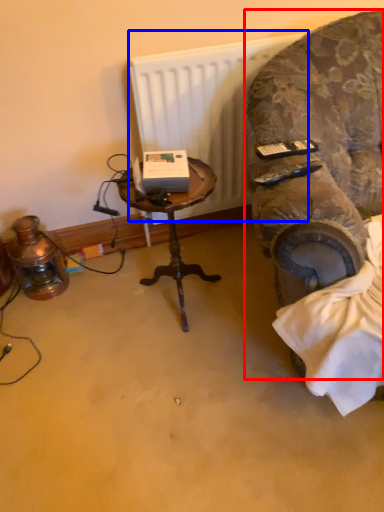
Question: Which of the following is the farthest to the observer, chair (highlighted by a red box) or radiator (highlighted by a blue box)?

Choices:
 (A) chair
 (B) radiator

Answer: (B)